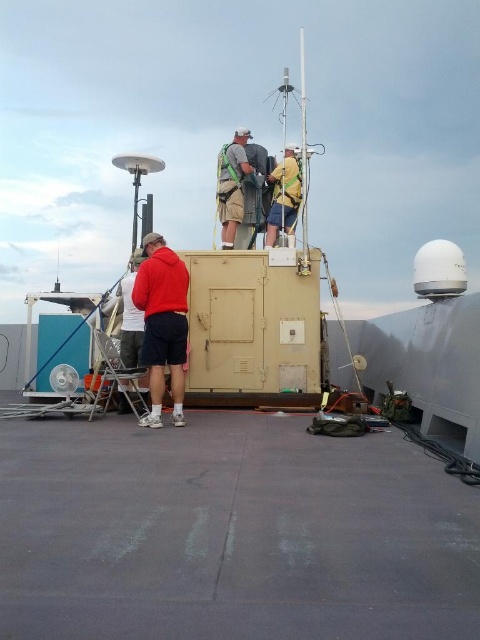
Question: Among these points, which one is nearest to the camera?

Choices:
 (A) (129, 408)
 (B) (230, 216)
 (C) (32, 474)
 (D) (300, 189)

Answer: (C)

Question: Can you confirm if matte red hoodie at center is positioned to the left of matte red jacket at lower left?

Choices:
 (A) yes
 (B) no

Answer: (B)

Question: Is khaki shorts at center wider than matte red jacket at lower left?

Choices:
 (A) yes
 (B) no

Answer: (A)

Question: From the image, what is the correct spatial relationship of matte red hoodie at center in relation to yellow fabric at center?

Choices:
 (A) right
 (B) left

Answer: (B)

Question: Considering the real-world distances, which object is farthest from the matte red hoodie at center?

Choices:
 (A) matte red jacket at lower left
 (B) khaki shorts at center
 (C) yellow fabric at center
 (D) gray rubber deck at center

Answer: (C)

Question: Which point is closer to the camera taking this photo?

Choices:
 (A) (158, 237)
 (B) (435, 605)

Answer: (B)